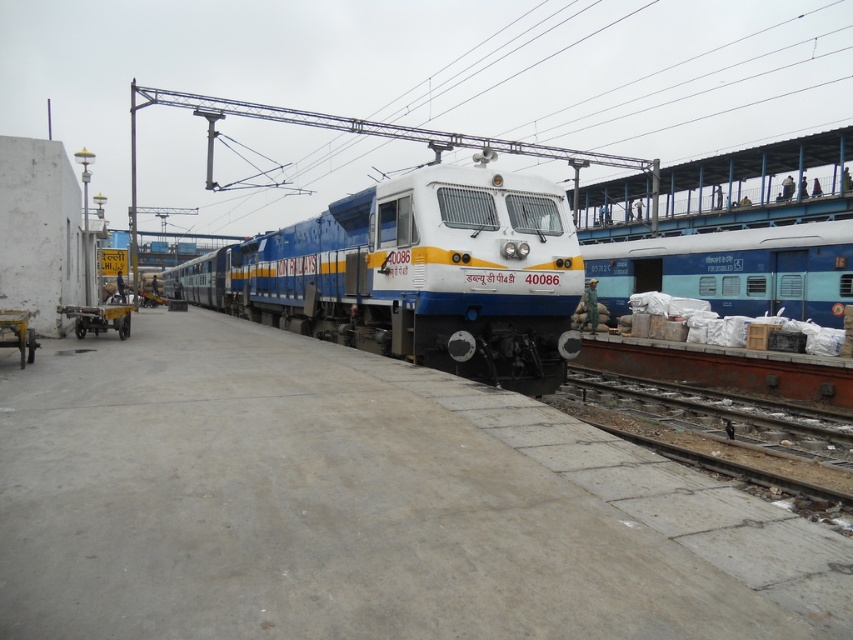
How distant is white glossy train at center from metallic silver cart at left?

The distance of white glossy train at center from metallic silver cart at left is 61.03 feet.

Can you confirm if white glossy train at center is positioned to the right of metallic silver cart at left?

Incorrect, white glossy train at center is not on the right side of metallic silver cart at left.

Is point (550, 243) positioned behind point (115, 321)?

No, (550, 243) is closer to viewer.

This screenshot has width=853, height=640. Find the location of `white glossy train at center`. white glossy train at center is located at coordinates (418, 275).

Can you confirm if white glossy train at center is positioned below rusty metal track at lower right?

Actually, white glossy train at center is above rusty metal track at lower right.

Find the location of a particular element. white glossy train at center is located at coordinates (418, 275).

Is white glossy train at center to the right of blue matte train at right from the viewer's perspective?

Incorrect, white glossy train at center is not on the right side of blue matte train at right.

Does point (209, 301) lie behind point (679, 252)?

Yes.

Locate an element on the screen. white glossy train at center is located at coordinates (418, 275).